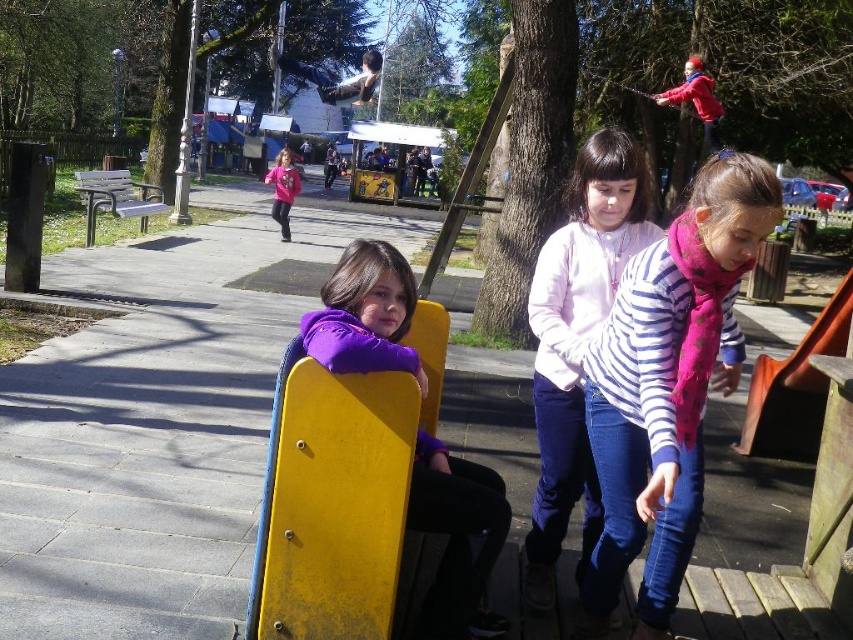
Question: Can you confirm if pink fabric shirt at center is wider than pink fleece jacket at center?

Choices:
 (A) yes
 (B) no

Answer: (B)

Question: Is striped cotton shirt at center above purple matte jacket at center?

Choices:
 (A) yes
 (B) no

Answer: (A)

Question: Which point is closer to the camera?

Choices:
 (A) pink fabric shirt at center
 (B) pink fleece jacket at center

Answer: (A)

Question: Does striped cotton shirt at center have a smaller size compared to purple matte jacket at center?

Choices:
 (A) yes
 (B) no

Answer: (B)

Question: Based on their relative distances, which object is nearer to the striped cotton shirt at center?

Choices:
 (A) purple matte jacket at center
 (B) pink fleece jacket at center
 (C) pink fabric shirt at center

Answer: (C)

Question: Which object is positioned farthest from the pink fabric shirt at center?

Choices:
 (A) pink fleece jacket at center
 (B) purple matte jacket at center
 (C) striped cotton shirt at center

Answer: (A)